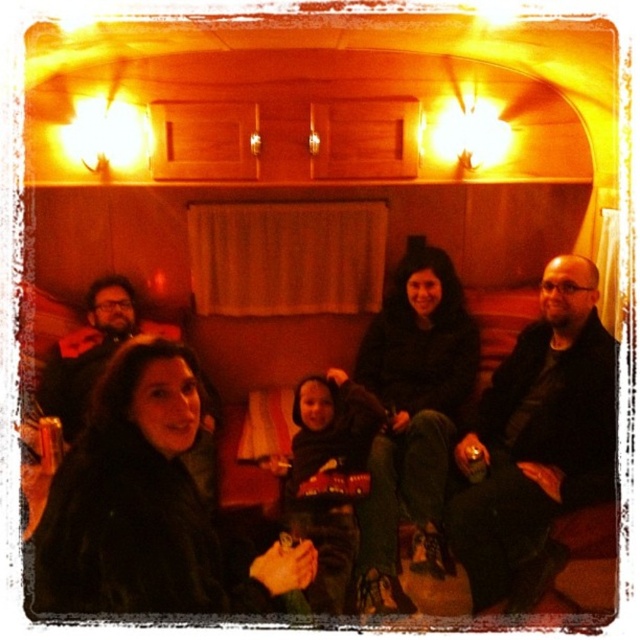
Who is more distant from viewer, (128, 388) or (481, 561)?

Point (481, 561)

Does black fuzzy coat at lower left have a larger size compared to black leather jacket at center?

No, black fuzzy coat at lower left is not bigger than black leather jacket at center.

The height and width of the screenshot is (640, 640). Describe the element at coordinates (147, 506) in the screenshot. I see `black fuzzy coat at lower left` at that location.

The image size is (640, 640). I want to click on black fuzzy coat at lower left, so click(x=147, y=506).

Between black fuzzy sweater at center and matte black jacket at left, which one has more height?

With more height is black fuzzy sweater at center.

Is black fuzzy sweater at center positioned before matte black jacket at left?

Yes, black fuzzy sweater at center is in front of matte black jacket at left.

Where is `black fuzzy sweater at center`? The height and width of the screenshot is (640, 640). black fuzzy sweater at center is located at coordinates (412, 420).

Is black fuzzy coat at lower left thinner than black fuzzy sweater at center?

Incorrect, black fuzzy coat at lower left's width is not less than black fuzzy sweater at center's.

Looking at this image, between black fuzzy coat at lower left and black fuzzy sweater at center, which one appears on the right side from the viewer's perspective?

Positioned to the right is black fuzzy sweater at center.

Find the location of a particular element. black fuzzy coat at lower left is located at coordinates (147, 506).

Locate an element on the screen. Image resolution: width=640 pixels, height=640 pixels. black fuzzy coat at lower left is located at coordinates click(x=147, y=506).